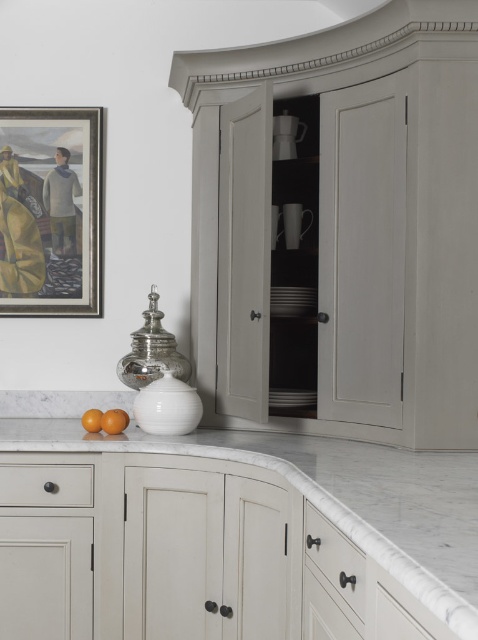
Question: Estimate the real-world distances between objects in this image. Which object is closer to the white marble countertop at center?

Choices:
 (A) matte white drawer at lower left
 (B) matte white drawer at lower center

Answer: (B)

Question: Can you confirm if matte gray cabinet at upper center is positioned below wooden frame at upper left?

Choices:
 (A) no
 (B) yes

Answer: (B)

Question: Which point is closer to the camera taking this photo?

Choices:
 (A) (423, 547)
 (B) (425, 436)
 (C) (97, 422)
 (D) (76, 476)

Answer: (A)

Question: Can you confirm if white marble countertop at center is wider than orange matte at lower left?

Choices:
 (A) yes
 (B) no

Answer: (A)

Question: Does white marble countertop at center lie behind matte white drawer at lower left?

Choices:
 (A) yes
 (B) no

Answer: (B)

Question: Which point is farther to the camera?

Choices:
 (A) orange matte at lower left
 (B) wooden frame at upper left

Answer: (B)